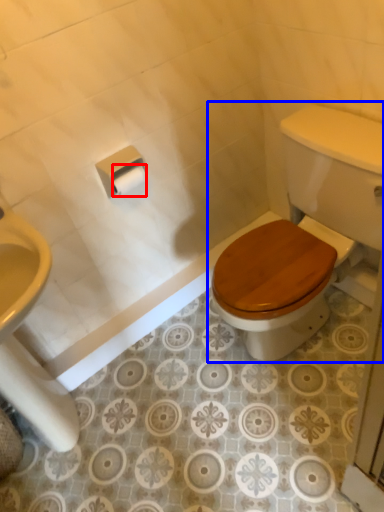
Question: Which of the following is the closest to the observer, toilet paper (highlighted by a red box) or toilet (highlighted by a blue box)?

Choices:
 (A) toilet paper
 (B) toilet

Answer: (B)